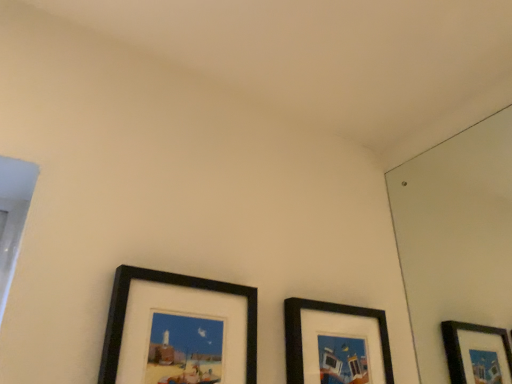
Question: Is black matte picture frame at center, arranged as the first picture frame when viewed from the right, bigger or smaller than black matte picture frame at lower left, the 1th picture frame in the left-to-right sequence?

Choices:
 (A) big
 (B) small

Answer: (B)

Question: From the image's perspective, relative to black matte picture frame at lower left, acting as the 2th picture frame starting from the right, is black matte picture frame at center, arranged as the first picture frame when viewed from the right, above or below?

Choices:
 (A) below
 (B) above

Answer: (A)

Question: Is black matte picture frame at center, arranged as the first picture frame when viewed from the right, taller or shorter than black matte picture frame at lower left, the 1th picture frame in the left-to-right sequence?

Choices:
 (A) tall
 (B) short

Answer: (B)

Question: From the image's perspective, is black matte picture frame at lower left, the 1th picture frame in the left-to-right sequence, positioned above or below black matte picture frame at center, arranged as the first picture frame when viewed from the right?

Choices:
 (A) above
 (B) below

Answer: (A)

Question: Is black matte picture frame at lower left, the 1th picture frame in the left-to-right sequence, in front of or behind black matte picture frame at center, the second picture frame in the left-to-right sequence, in the image?

Choices:
 (A) behind
 (B) front

Answer: (B)

Question: Looking at their shapes, would you say black matte picture frame at lower left, acting as the 2th picture frame starting from the right, is wider or thinner than black matte picture frame at center, arranged as the first picture frame when viewed from the right?

Choices:
 (A) wide
 (B) thin

Answer: (A)

Question: Is black matte picture frame at lower left, acting as the 2th picture frame starting from the right, bigger or smaller than black matte picture frame at center, arranged as the first picture frame when viewed from the right?

Choices:
 (A) big
 (B) small

Answer: (A)